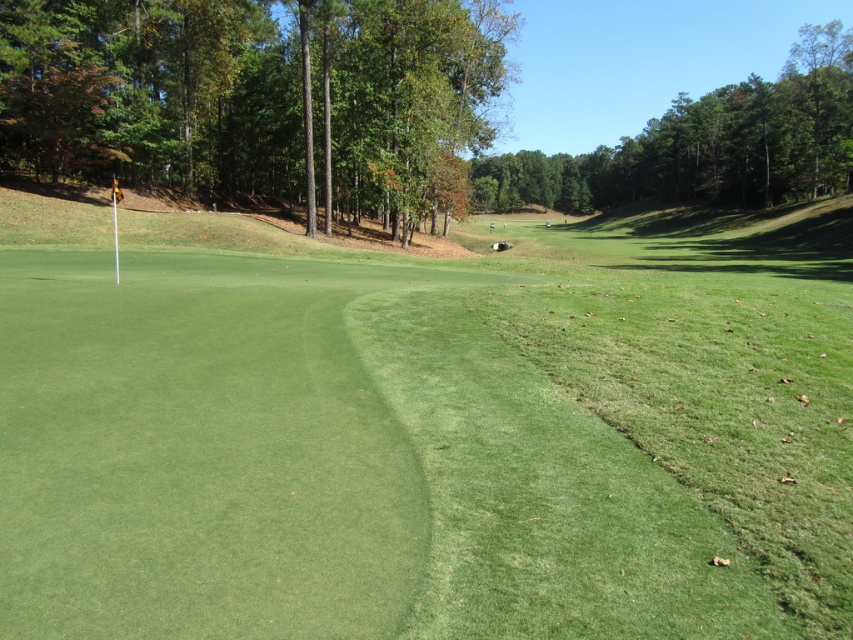
Question: Can you confirm if green smooth turf at center is positioned to the right of green leafy tree at upper center?

Choices:
 (A) no
 (B) yes

Answer: (B)

Question: Which object appears closest to the camera in this image?

Choices:
 (A) green leafy tree at upper center
 (B) green leafy tree at upper right

Answer: (A)

Question: Is green smooth turf at center bigger than green leafy tree at upper right?

Choices:
 (A) no
 (B) yes

Answer: (A)

Question: Which of the following is the farthest from the observer?

Choices:
 (A) (16, 54)
 (B) (277, 316)

Answer: (A)

Question: Does green leafy tree at upper center appear under green leafy tree at upper right?

Choices:
 (A) yes
 (B) no

Answer: (A)

Question: Which of the following is the farthest from the observer?

Choices:
 (A) (723, 177)
 (B) (636, 340)
 (C) (35, 93)

Answer: (A)